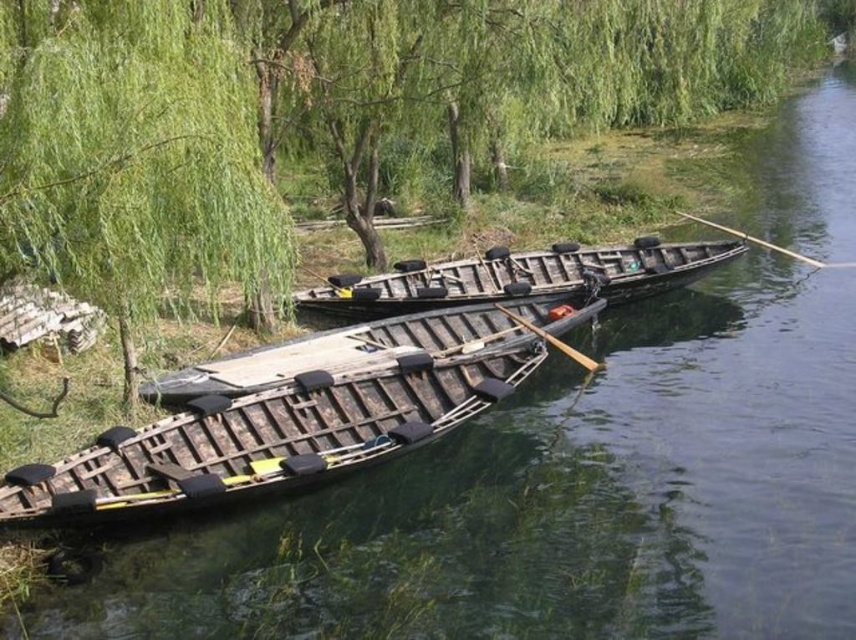
You are standing at the riverside and see two points marked on the image. The first point is at coordinates point (55,177) and the second is at point (548,276). If you were to walk towards the river from your current position, which point would you encounter first?

Point (55,177) is in front of point (548,276), so you would encounter point (55,177) first as you walk towards the river.